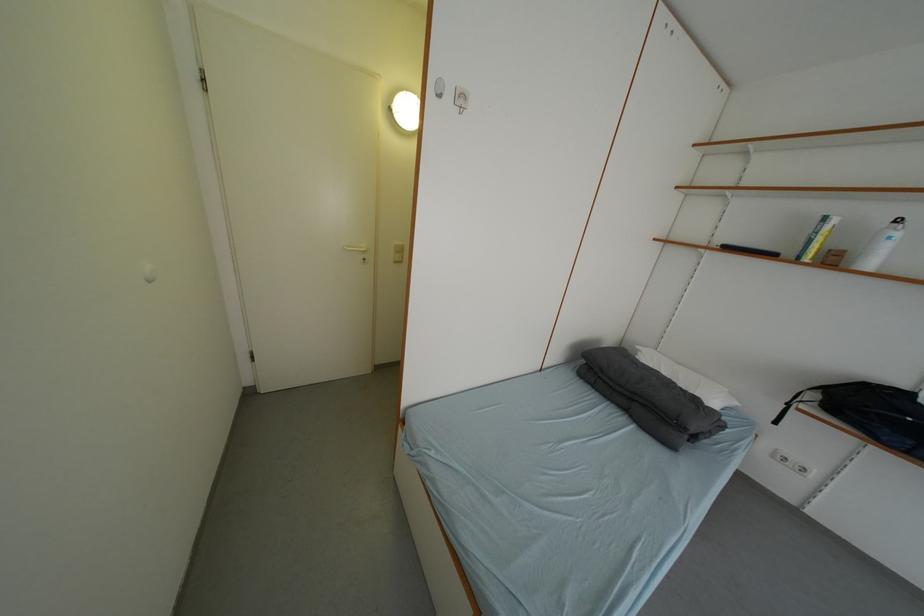
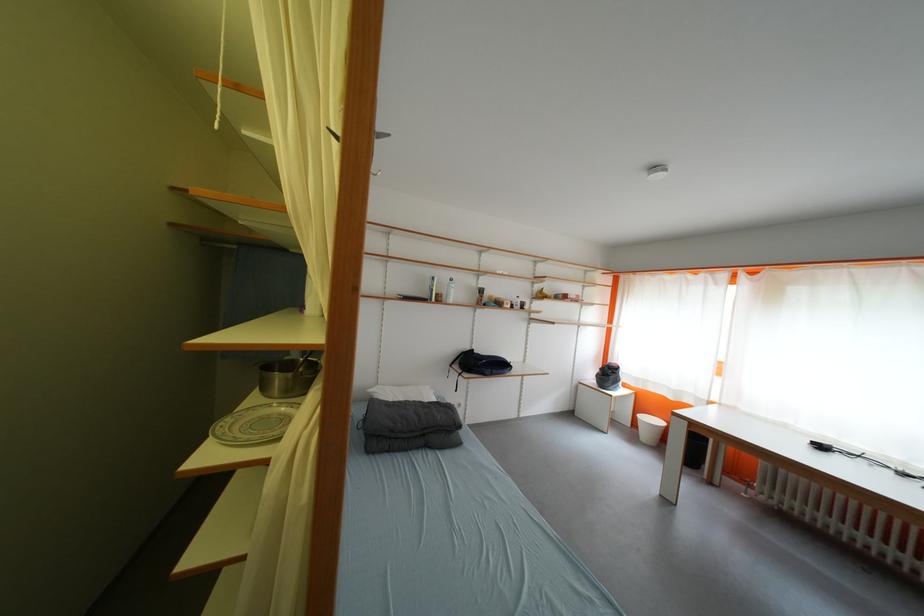
In the second image, find the point that corresponds to point (648, 351) in the first image.

(380, 392)